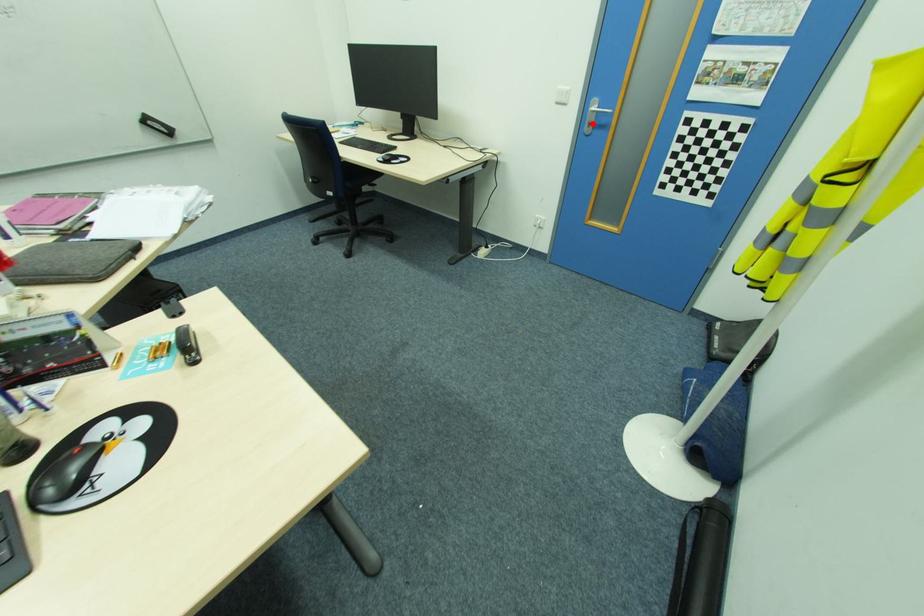
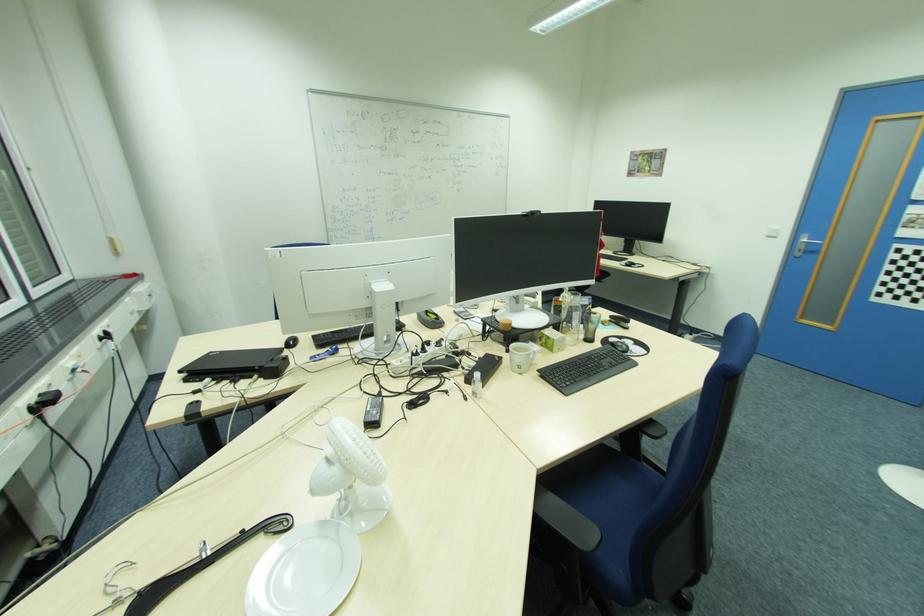
The point at the highlighted location is marked in the first image. Where is the corresponding point in the second image?

(804, 251)